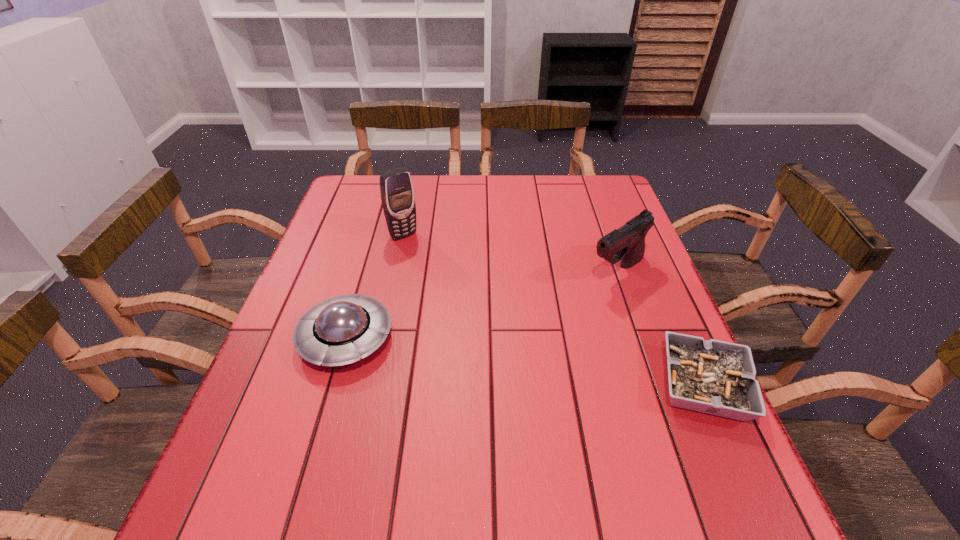
Locate an element on the screen. the third tallest object is located at coordinates [x=338, y=331].

The height and width of the screenshot is (540, 960). What are the coordinates of `the shortest object` in the screenshot? It's located at (715, 377).

I want to click on cellular telephone, so click(397, 194).

Locate an element on the screen. Image resolution: width=960 pixels, height=540 pixels. the farthest object is located at coordinates 397,194.

What are the coordinates of `the second tallest object` in the screenshot? It's located at (627, 243).

I want to click on pistol, so click(x=627, y=243).

The height and width of the screenshot is (540, 960). What are the coordinates of `blank space located on the right of the saucer` in the screenshot? It's located at (465, 338).

Where is `free space located 0.200m on the left of the ashtray`? This screenshot has height=540, width=960. free space located 0.200m on the left of the ashtray is located at coordinates click(x=555, y=384).

Where is `vacant region located on the front face of the farthest object`? This screenshot has width=960, height=540. vacant region located on the front face of the farthest object is located at coordinates (434, 266).

Identify the location of free space located on the front face of the farthest object. The height and width of the screenshot is (540, 960). (438, 271).